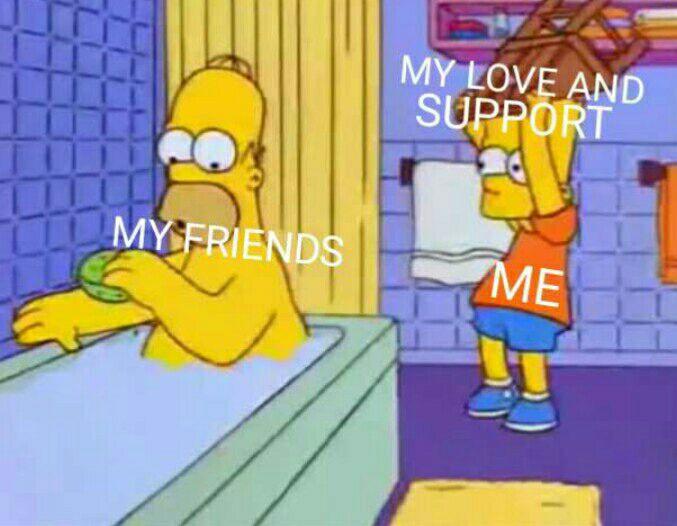
Find the location of a particular element. rack is located at coordinates (647, 170).